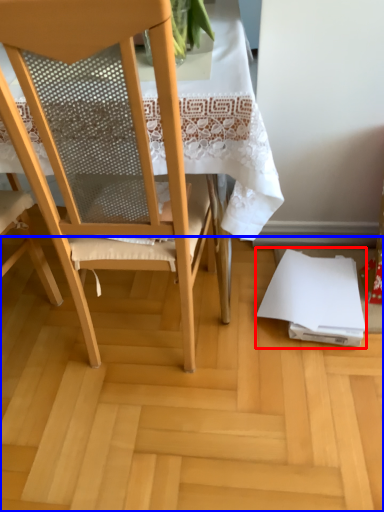
Question: Among these objects, which one is farthest to the camera, notebook (highlighted by a red box) or plywood (highlighted by a blue box)?

Choices:
 (A) notebook
 (B) plywood

Answer: (A)